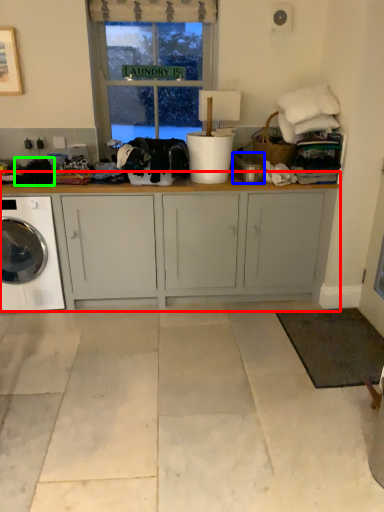
Question: Based on their relative distances, which object is nearer to cabinetry (highlighted by a red box)? Choose from appliance (highlighted by a blue box) and clothing (highlighted by a green box).

Choices:
 (A) appliance
 (B) clothing

Answer: (A)